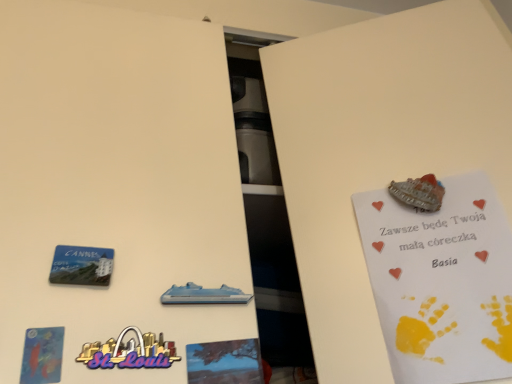
Question: From a real-world perspective, does matte blue postcard at lower left, placed as the second postcard when sorted from back to front, sit lower than blue plastic cruise ship at center?

Choices:
 (A) yes
 (B) no

Answer: (A)

Question: Is matte blue postcard at lower left, acting as the second postcard starting from the right, to the left of blue plastic cruise ship at center from the viewer's perspective?

Choices:
 (A) yes
 (B) no

Answer: (A)

Question: Considering the relative positions of matte blue postcard at lower left, placed as the second postcard when sorted from back to front, and blue plastic cruise ship at center in the image provided, is matte blue postcard at lower left, placed as the second postcard when sorted from back to front, behind blue plastic cruise ship at center?

Choices:
 (A) no
 (B) yes

Answer: (A)

Question: Can you confirm if matte blue postcard at lower left, placed as the second postcard when sorted from back to front, is taller than blue plastic cruise ship at center?

Choices:
 (A) no
 (B) yes

Answer: (B)

Question: In terms of height, does blue plastic magnet at lower left look taller or shorter compared to blue plastic cruise ship at center?

Choices:
 (A) tall
 (B) short

Answer: (A)

Question: Is point (66, 268) positioned closer to the camera than point (223, 296)?

Choices:
 (A) farther
 (B) closer

Answer: (B)

Question: From the image's perspective, is blue plastic magnet at lower left positioned above or below blue plastic cruise ship at center?

Choices:
 (A) above
 (B) below

Answer: (A)

Question: In the image, is blue plastic magnet at lower left positioned in front of or behind blue plastic cruise ship at center?

Choices:
 (A) front
 (B) behind

Answer: (A)

Question: Visually, is blue matte tree at center positioned to the left or to the right of white paper postcard at upper right, which is counted as the first postcard, starting from the right?

Choices:
 (A) right
 (B) left

Answer: (B)

Question: Is point (240, 344) closer or farther from the camera than point (476, 205)?

Choices:
 (A) closer
 (B) farther

Answer: (A)

Question: In the image, is blue matte tree at center positioned in front of or behind white paper postcard at upper right, positioned as the second postcard in left-to-right order?

Choices:
 (A) front
 (B) behind

Answer: (A)

Question: From a real-world perspective, is blue matte tree at center positioned above or below white paper postcard at upper right, which is the 1th postcard in back-to-front order?

Choices:
 (A) below
 (B) above

Answer: (A)

Question: Is point tap(430, 380) positioned closer to the camera than point tap(109, 276)?

Choices:
 (A) farther
 (B) closer

Answer: (A)

Question: Based on their positions, is white paper postcard at upper right, positioned as the second postcard in left-to-right order, located to the left or right of blue plastic magnet at lower left?

Choices:
 (A) left
 (B) right

Answer: (B)